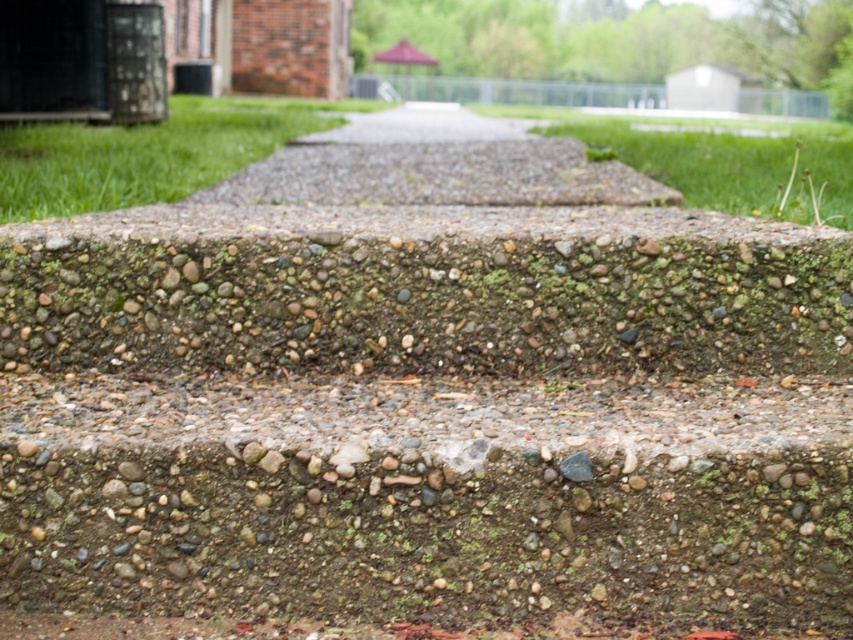
You are standing on the steps and looking towards the brick building. Which area of green grass, the green grass at upper left or the green grass at center, is wider?

The green grass at center is wider than the green grass at upper left.

You are standing on the pebble concrete pavement at center and want to walk towards the brick building visible in the background. Which direction should you head relative to the green grass at upper left?

Since the green grass at upper left is to the left of the pebble concrete pavement at center, you should head to the right of the green grass at upper left to reach the brick building in the background.

You are a gardener who needs to mow the lawn. Based on the scene, which area should you prioritize first between the green grass at upper left and the pebble concrete pavement at center?

The green grass at upper left should be prioritized first because it is much taller than the pebble concrete pavement at center, indicating it needs immediate mowing.